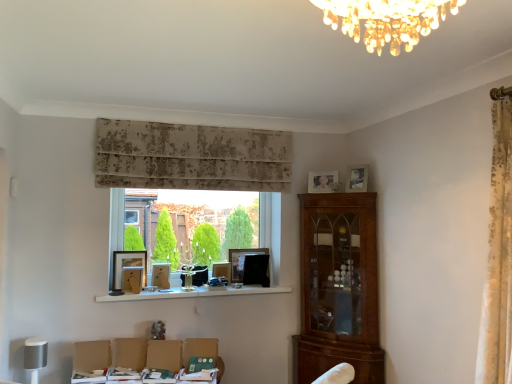
Image resolution: width=512 pixels, height=384 pixels. What are the coordinates of `matte black picture frame at center, acting as the 4th picture frame starting from the left` in the screenshot? It's located at (241, 260).

In order to face matte black picture frame at center, which appears as the 3th picture frame when viewed from the right, should I rotate leftwards or rightwards?

To face it directly, rotate left by 1.071 degrees.

The width and height of the screenshot is (512, 384). What do you see at coordinates (321, 181) in the screenshot?
I see `matte wooden picture frame at upper right, which is counted as the 2th picture frame, starting from the right` at bounding box center [321, 181].

You are a GUI agent. You are given a task and a screenshot of the screen. Output one action in this format:
    pyautogui.click(x=<x>, y=<y>)
    Task: Click on the cardboard box at lower left, the 1th swivel chair positioned from the left
    Image resolution: width=512 pixels, height=384 pixels.
    Given the screenshot: What is the action you would take?
    pyautogui.click(x=91, y=361)

What do you see at coordinates (123, 216) in the screenshot? I see `clear glass window at center` at bounding box center [123, 216].

This screenshot has height=384, width=512. Identify the location of matte black picture frame at center, acting as the 4th picture frame starting from the left. (241, 260).

Looking at this image, considering the positions of objects beige textured curtain at upper center and teal fabric swivel chair at lower center, the 1th swivel chair in the right-to-left sequence, in the image provided, who is more to the right, beige textured curtain at upper center or teal fabric swivel chair at lower center, the 1th swivel chair in the right-to-left sequence,?

teal fabric swivel chair at lower center, the 1th swivel chair in the right-to-left sequence, is more to the right.

Looking at the image, does beige textured curtain at upper center seem bigger or smaller compared to teal fabric swivel chair at lower center, which is the 2th swivel chair in left-to-right order?

Considering their sizes, beige textured curtain at upper center takes up more space than teal fabric swivel chair at lower center, which is the 2th swivel chair in left-to-right order.

Is beige textured curtain at upper center with teal fabric swivel chair at lower center, the 1th swivel chair in the right-to-left sequence?

No, beige textured curtain at upper center is not beside teal fabric swivel chair at lower center, the 1th swivel chair in the right-to-left sequence.

Consider the image. Is beige textured curtain at upper center looking in the opposite direction of teal fabric swivel chair at lower center, the 1th swivel chair in the right-to-left sequence?

No, teal fabric swivel chair at lower center, the 1th swivel chair in the right-to-left sequence, is not at the back of beige textured curtain at upper center.

Is matte black picture frame at center, the 4th picture frame positioned from the right, situated inside beige textured curtain at upper center or outside?

matte black picture frame at center, the 4th picture frame positioned from the right, exists outside the volume of beige textured curtain at upper center.

Consider the image. Considering the relative sizes of matte black picture frame at center, which is the third picture frame in left-to-right order, and beige textured curtain at upper center in the image provided, is matte black picture frame at center, which is the third picture frame in left-to-right order, wider than beige textured curtain at upper center?

No.

Considering the positions of objects matte black picture frame at center, the 4th picture frame positioned from the right, and beige textured curtain at upper center in the image provided, who is more to the right, matte black picture frame at center, the 4th picture frame positioned from the right, or beige textured curtain at upper center?

matte black picture frame at center, the 4th picture frame positioned from the right, is more to the right.

Is matte black picture frame at center, which is the third picture frame in left-to-right order, behind beige textured curtain at upper center?

That is True.

From the image's perspective, does matte silver picture frame at upper right, positioned as the 1th picture frame in right-to-left order, appear lower than matte black picture frame at center, acting as the 4th picture frame starting from the left?

No, from the image's perspective, matte silver picture frame at upper right, positioned as the 1th picture frame in right-to-left order, is not below matte black picture frame at center, acting as the 4th picture frame starting from the left.

From a real-world perspective, is matte silver picture frame at upper right, arranged as the sixth picture frame when viewed from the left, located beneath matte black picture frame at center, which appears as the 3th picture frame when viewed from the right?

Actually, matte silver picture frame at upper right, arranged as the sixth picture frame when viewed from the left, is physically above matte black picture frame at center, which appears as the 3th picture frame when viewed from the right, in the real world.

This screenshot has width=512, height=384. In order to click on the 5th picture frame in front of the matte black picture frame at center, which appears as the 3th picture frame when viewed from the right in this screenshot , I will do `click(357, 178)`.

Is matte black picture frame at window sill, positioned as the 1th picture frame in left-to-right order, situated inside matte wooden picture frame at center, which ranks as the 2th picture frame in left-to-right order, or outside?

matte black picture frame at window sill, positioned as the 1th picture frame in left-to-right order, is located beyond the bounds of matte wooden picture frame at center, which ranks as the 2th picture frame in left-to-right order.

Which point is more distant from viewer, (129, 257) or (162, 288)?

The point (129, 257) is farther.

In the scene shown: Who is taller, matte black picture frame at window sill, positioned as the 1th picture frame in left-to-right order, or matte wooden picture frame at center, which ranks as the 2th picture frame in left-to-right order?

matte black picture frame at window sill, positioned as the 1th picture frame in left-to-right order.

Is matte black picture frame at window sill, arranged as the sixth picture frame when viewed from the right, bigger or smaller than matte wooden picture frame at center, acting as the 5th picture frame starting from the right?

matte black picture frame at window sill, arranged as the sixth picture frame when viewed from the right, is bigger than matte wooden picture frame at center, acting as the 5th picture frame starting from the right.

Is teal fabric swivel chair at lower center, the 1th swivel chair in the right-to-left sequence, taller than clear glass window at center?

In fact, teal fabric swivel chair at lower center, the 1th swivel chair in the right-to-left sequence, may be shorter than clear glass window at center.

Considering the sizes of objects teal fabric swivel chair at lower center, the 1th swivel chair in the right-to-left sequence, and clear glass window at center in the image provided, who is thinner, teal fabric swivel chair at lower center, the 1th swivel chair in the right-to-left sequence, or clear glass window at center?

With smaller width is teal fabric swivel chair at lower center, the 1th swivel chair in the right-to-left sequence.

Could you tell me if teal fabric swivel chair at lower center, which is the 2th swivel chair in left-to-right order, is turned towards clear glass window at center?

No, teal fabric swivel chair at lower center, which is the 2th swivel chair in left-to-right order, is not turned towards clear glass window at center.

From a real-world perspective, is teal fabric swivel chair at lower center, which is the 2th swivel chair in left-to-right order, under clear glass window at center?

Indeed, from a real-world perspective, teal fabric swivel chair at lower center, which is the 2th swivel chair in left-to-right order, is positioned beneath clear glass window at center.

Is the position of matte brown armchair at lower center more distant than that of matte wooden picture frame at upper right, which is counted as the 2th picture frame, starting from the right?

No, matte brown armchair at lower center is in front of matte wooden picture frame at upper right, which is counted as the 2th picture frame, starting from the right.

Which of these two, matte brown armchair at lower center or matte wooden picture frame at upper right, which is counted as the 2th picture frame, starting from the right, is thinner?

matte brown armchair at lower center.

Which is closer to the camera, (154, 358) or (328, 182)?

Point (154, 358) is closer to the camera than point (328, 182).

What's the angular difference between matte brown armchair at lower center and matte wooden picture frame at upper right, which is counted as the 2th picture frame, starting from the right,'s facing directions?

24.7 degrees.

Based on the photo, is matte silver picture frame at upper right, arranged as the sixth picture frame when viewed from the left, facing towards matte black picture frame at center, which is the third picture frame in left-to-right order?

No.

Image resolution: width=512 pixels, height=384 pixels. There is a matte black picture frame at center, which is the third picture frame in left-to-right order. Find the location of `the 5th picture frame above it (from the image's perspective)`. the 5th picture frame above it (from the image's perspective) is located at coordinates (357, 178).

Can you tell me how much matte silver picture frame at upper right, positioned as the 1th picture frame in right-to-left order, and matte black picture frame at center, which is the third picture frame in left-to-right order, differ in facing direction?

They differ by 63.3 degrees in their facing directions.

From the image's perspective, who appears lower, matte silver picture frame at upper right, arranged as the sixth picture frame when viewed from the left, or matte black picture frame at center, which is the third picture frame in left-to-right order?

From the image's view, matte black picture frame at center, which is the third picture frame in left-to-right order, is below.

Locate an element on the screen. curtain on the left of the teal fabric swivel chair at lower center, the 1th swivel chair in the right-to-left sequence is located at coordinates (191, 157).

Locate an element on the screen. The height and width of the screenshot is (384, 512). curtain located above the matte black picture frame at center, which is the third picture frame in left-to-right order (from the image's perspective) is located at coordinates (191, 157).

Looking at the image, which one is located further to beige textured curtain at upper center, cardboard box at lower left, the 1th swivel chair positioned from the left, or teal fabric swivel chair at lower center, the 1th swivel chair in the right-to-left sequence?

cardboard box at lower left, the 1th swivel chair positioned from the left, lies further to beige textured curtain at upper center than the other object.

Looking at the image, which one is located closer to matte wooden picture frame at center, acting as the 5th picture frame starting from the right, beige textured curtain at upper center or white glossy shelf at center?

white glossy shelf at center.

When comparing their distances from matte black picture frame at window sill, positioned as the 1th picture frame in left-to-right order, does matte black picture frame at center, which is the third picture frame in left-to-right order, or matte black picture frame at center, acting as the 4th picture frame starting from the left, seem closer?

matte black picture frame at center, which is the third picture frame in left-to-right order, lies closer to matte black picture frame at window sill, positioned as the 1th picture frame in left-to-right order, than the other object.

Based on their spatial positions, is matte wooden picture frame at center, which ranks as the 2th picture frame in left-to-right order, or cardboard box at lower left, the 1th swivel chair positioned from the left, further from matte black picture frame at center, the 4th picture frame positioned from the right?

The object further to matte black picture frame at center, the 4th picture frame positioned from the right, is cardboard box at lower left, the 1th swivel chair positioned from the left.

Based on their spatial positions, is matte silver picture frame at upper right, positioned as the 1th picture frame in right-to-left order, or cardboard box at lower left, the 1th swivel chair positioned from the left, closer to beige textured curtain at upper center?

matte silver picture frame at upper right, positioned as the 1th picture frame in right-to-left order, is positioned closer to the anchor beige textured curtain at upper center.

When comparing their distances from beige textured curtain at upper center, does matte brown armchair at lower center or matte black picture frame at center, which is the third picture frame in left-to-right order, seem closer?

The object closer to beige textured curtain at upper center is matte black picture frame at center, which is the third picture frame in left-to-right order.

Estimate the real-world distances between objects in this image. Which object is further from matte silver picture frame at upper right, positioned as the 1th picture frame in right-to-left order, matte wooden picture frame at upper right, which ranks as the fifth picture frame in left-to-right order, or matte black picture frame at center, the 4th picture frame positioned from the right?

Based on the image, matte black picture frame at center, the 4th picture frame positioned from the right, appears to be further to matte silver picture frame at upper right, positioned as the 1th picture frame in right-to-left order.

Based on their spatial positions, is white glossy shelf at center or beige textured curtain at upper center further from clear glass window at center?

Based on the image, white glossy shelf at center appears to be further to clear glass window at center.

Find the location of a particular element. The image size is (512, 384). armchair between beige textured curtain at upper center and teal fabric swivel chair at lower center, which is the 2th swivel chair in left-to-right order, from top to bottom is located at coordinates (164, 355).

This screenshot has width=512, height=384. What are the coordinates of `curtain located between clear glass window at center and matte wooden picture frame at upper right, which is counted as the 2th picture frame, starting from the right, in the left-right direction` in the screenshot? It's located at (191, 157).

Identify the location of picture frame between matte black picture frame at center, acting as the 4th picture frame starting from the left, and matte silver picture frame at upper right, arranged as the sixth picture frame when viewed from the left, in the horizontal direction. This screenshot has width=512, height=384. (321, 181).

Find the location of a particular element. The image size is (512, 384). window between matte wooden picture frame at center, which ranks as the 2th picture frame in left-to-right order, and matte black picture frame at center, which appears as the 3th picture frame when viewed from the right is located at coordinates (123, 216).